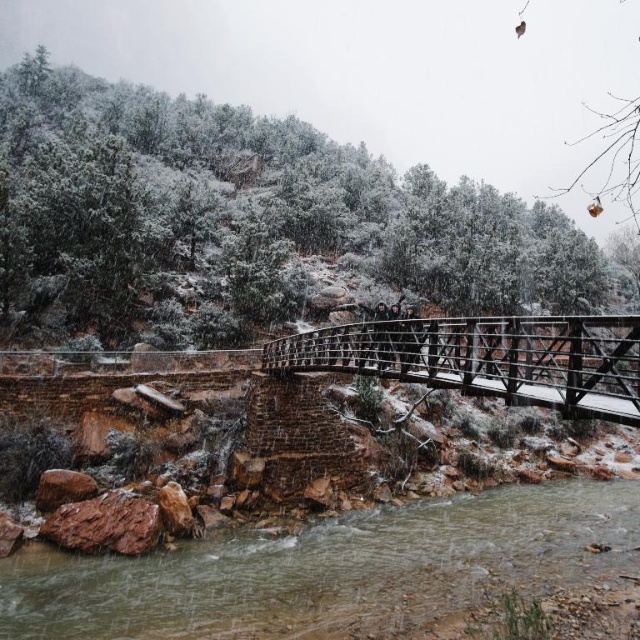
You are a hiker trying to cross the river using the wooden bridge at center. You are wearing the dark brown leather jacket at center. If the bridge can only support objects up to the size of the jacket, will you be able to cross safely?

The wooden bridge at center has a larger size compared to the dark brown leather jacket at center. Since the bridge can support objects up to the jacket size, and the bridge itself is larger, it should be able to support the hiker wearing the jacket safely.

You are standing on the wooden bridge and notice the clear water at lower left and the dark gray fabric jacket at center. Which object appears taller from your viewpoint?

The clear water at lower left appears taller than the dark gray fabric jacket at center.